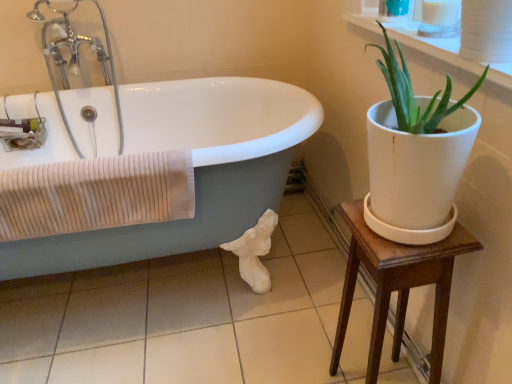
Question: Is white glossy bathtub at left bigger or smaller than wooden table at right?

Choices:
 (A) big
 (B) small

Answer: (A)

Question: In terms of height, does white glossy bathtub at left look taller or shorter compared to wooden table at right?

Choices:
 (A) tall
 (B) short

Answer: (A)

Question: Which of these objects is positioned closest to the white glossy bathtub at left?

Choices:
 (A) wooden table at right
 (B) white ceramic plant at upper right
 (C) chrome metallic faucet at upper left
 (D) beige ribbed towel at left
 (E) white glossy tile at lower center

Answer: (C)

Question: Which is nearer to the chrome metallic faucet at upper left?

Choices:
 (A) wooden table at right
 (B) white glossy bathtub at left
 (C) white ceramic plant at upper right
 (D) beige ribbed towel at left
 (E) white glossy tile at lower center

Answer: (B)